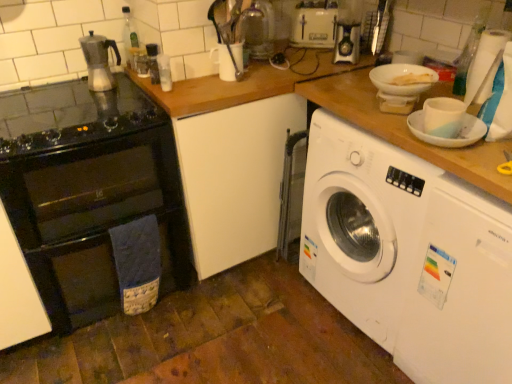
Question: Considering the relative positions of satin silver tea pot at upper left and black glass gas stove at left in the image provided, is satin silver tea pot at upper left to the left of black glass gas stove at left from the viewer's perspective?

Choices:
 (A) yes
 (B) no

Answer: (B)

Question: Can you confirm if satin silver tea pot at upper left is thinner than black glass gas stove at left?

Choices:
 (A) no
 (B) yes

Answer: (B)

Question: Would you say satin silver tea pot at upper left contains black glass gas stove at left?

Choices:
 (A) no
 (B) yes

Answer: (A)

Question: From a real-world perspective, is satin silver tea pot at upper left located beneath black glass gas stove at left?

Choices:
 (A) no
 (B) yes

Answer: (A)

Question: Does satin silver tea pot at upper left have a smaller size compared to black glass gas stove at left?

Choices:
 (A) no
 (B) yes

Answer: (B)

Question: Is satin silver tea pot at upper left outside black glass gas stove at left?

Choices:
 (A) yes
 (B) no

Answer: (A)

Question: Is black glass gas stove at left closer to camera compared to transparent plastic bottle at upper right, positioned as the 4th bottle in left-to-right order?

Choices:
 (A) yes
 (B) no

Answer: (A)

Question: Does black glass gas stove at left have a greater width compared to transparent plastic bottle at upper right, positioned as the 4th bottle in left-to-right order?

Choices:
 (A) yes
 (B) no

Answer: (A)

Question: From a real-world perspective, does black glass gas stove at left sit lower than transparent plastic bottle at upper right, positioned as the 4th bottle in left-to-right order?

Choices:
 (A) no
 (B) yes

Answer: (B)

Question: Does black glass gas stove at left come behind transparent plastic bottle at upper right, positioned as the 4th bottle in left-to-right order?

Choices:
 (A) yes
 (B) no

Answer: (B)

Question: Could you tell me if black glass gas stove at left is turned towards transparent plastic bottle at upper right, positioned as the 4th bottle in left-to-right order?

Choices:
 (A) no
 (B) yes

Answer: (A)

Question: Is transparent plastic bottle at upper right, which is counted as the 1th bottle, starting from the right, completely or partially inside black glass gas stove at left?

Choices:
 (A) yes
 (B) no

Answer: (B)

Question: Are black glass oven at left and transparent plastic bottle at upper right, which is counted as the 1th bottle, starting from the right, making contact?

Choices:
 (A) no
 (B) yes

Answer: (A)